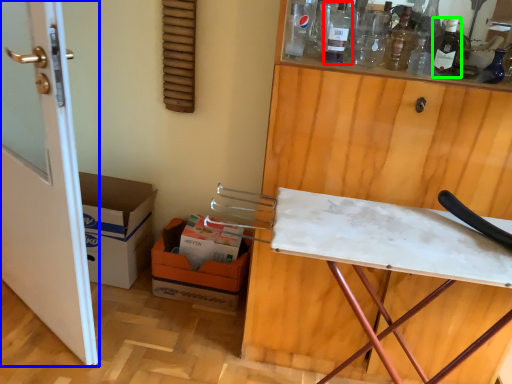
Question: Which object is the farthest from bottle (highlighted by a red box)? Choose among these: door (highlighted by a blue box) or wine bottle (highlighted by a green box).

Choices:
 (A) door
 (B) wine bottle

Answer: (A)